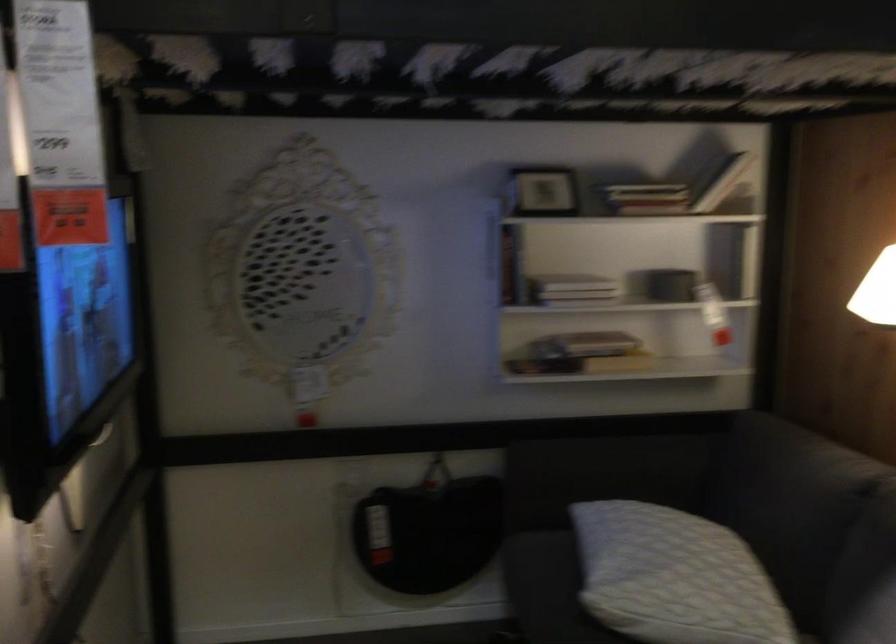
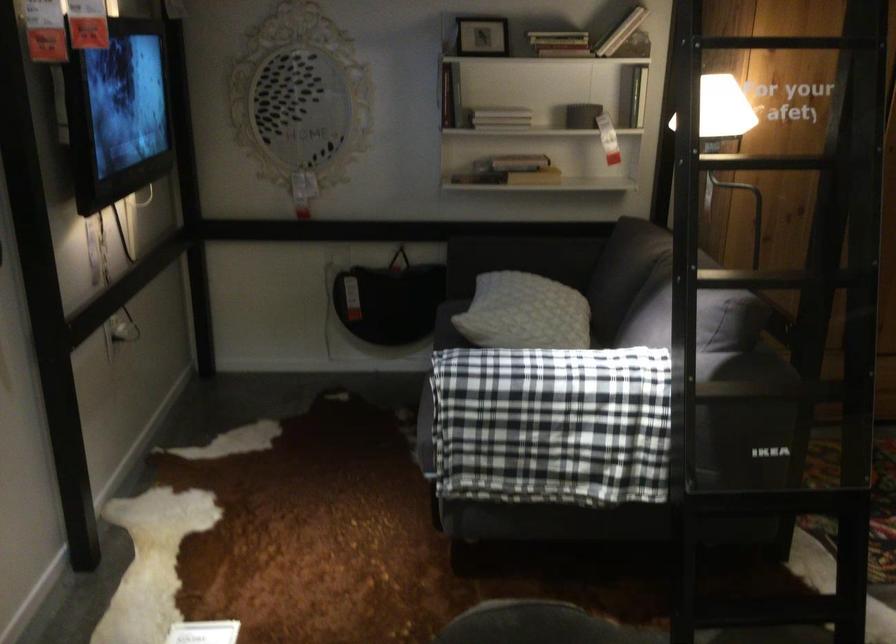
Find the pixel in the second image that matches point 581,299 in the first image.

(500, 118)